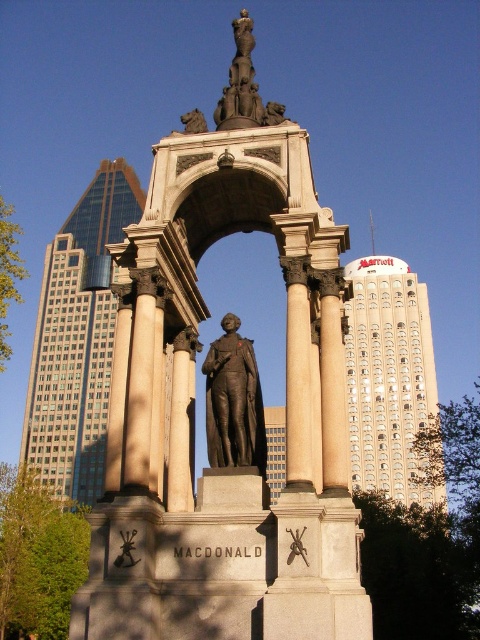
How much distance is there between bronze statue at center and white marble column at center?

bronze statue at center and white marble column at center are 7.12 meters apart from each other.

Is bronze statue at center wider than white marble column at center?

Yes, bronze statue at center is wider than white marble column at center.

Image resolution: width=480 pixels, height=640 pixels. Find the location of `bronze statue at center`. bronze statue at center is located at coordinates (228, 417).

Which of these two, bronze statue at center or white glass tower at upper right, stands taller?

white glass tower at upper right is taller.

Between point (204, 550) and point (349, 385), which one is positioned in front?

Point (204, 550) is in front.

Which is behind, point (196, 168) or point (357, 376)?

The point (357, 376) is more distant.

Image resolution: width=480 pixels, height=640 pixels. Identify the location of bronze statue at center. (228, 417).

Who is lower down, glassy steel skyscraper at left or polished bronze statue at upper center?

Positioned lower is glassy steel skyscraper at left.

Who is higher up, glassy steel skyscraper at left or polished bronze statue at upper center?

polished bronze statue at upper center is higher up.

Find the location of `glassy steel skyscraper at left`. glassy steel skyscraper at left is located at coordinates click(78, 337).